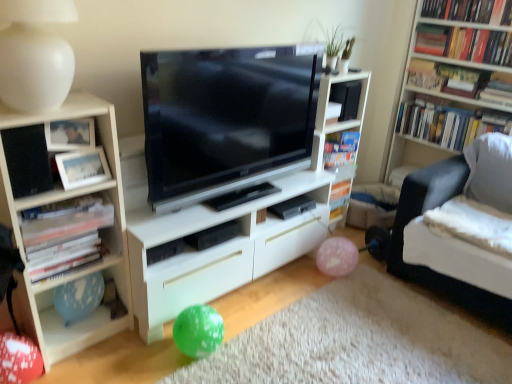
What are the coordinates of `free spot above hardcover book at upper right, the fourth book positioned from the bottom (from a real-world perspective)` in the screenshot? It's located at (485, 28).